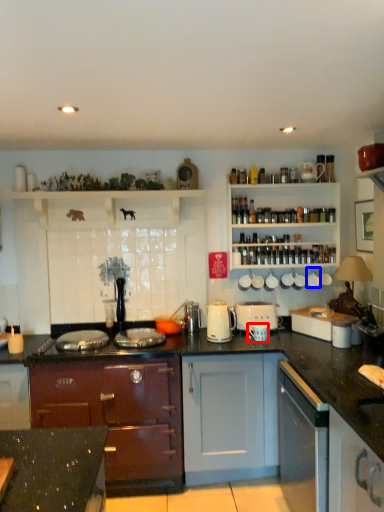
Question: Which of the following is the closest to the observer, appliance (highlighted by a red box) or appliance (highlighted by a blue box)?

Choices:
 (A) appliance
 (B) appliance

Answer: (A)